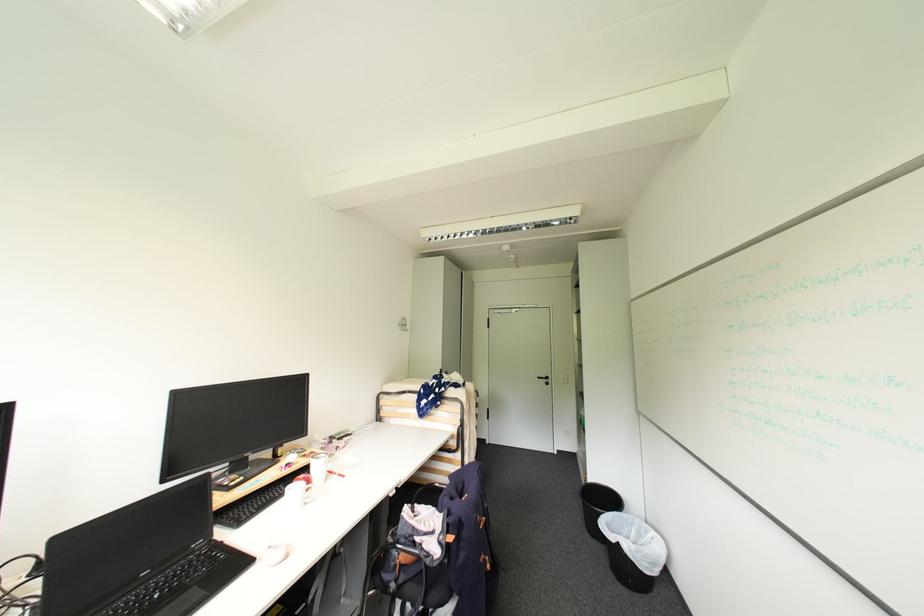
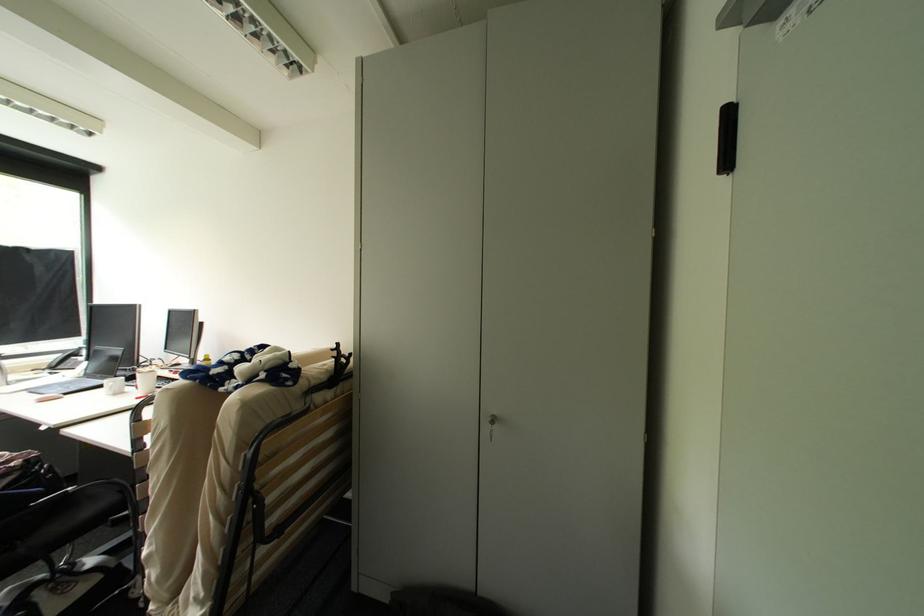
Question: I am providing you with two images of the same scene from different viewpoints. Please identify which objects are invisible in image2.

Choices:
 (A) pink rectangular pillow
 (B) cabinet key
 (C) chair sitting surface
 (D) white mug

Answer: (C)